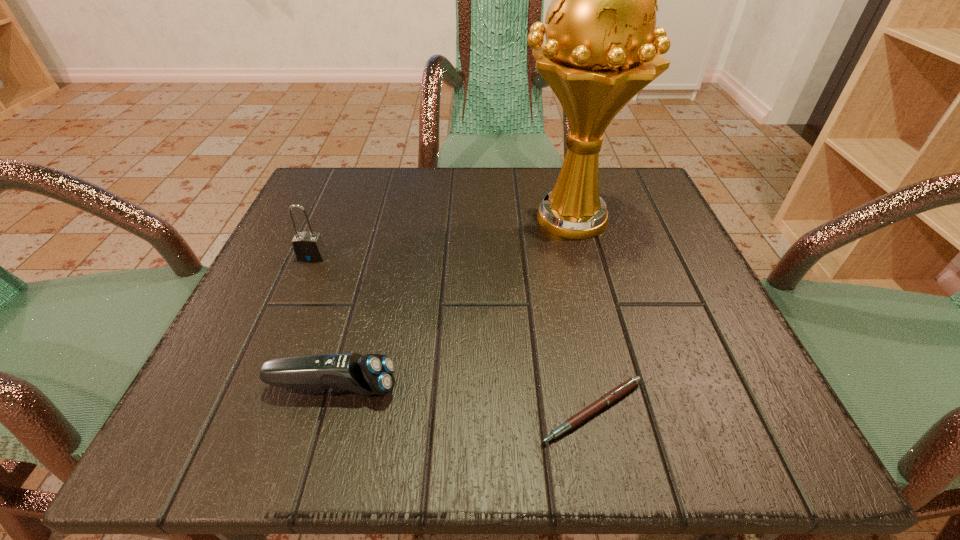
The width and height of the screenshot is (960, 540). Identify the location of trophy_cup. (602, 44).

Locate an element on the screen. The image size is (960, 540). the third shortest object is located at coordinates (308, 246).

This screenshot has height=540, width=960. I want to click on electric shaver, so click(x=372, y=374).

Identify the location of pen. click(x=621, y=390).

Where is `vacant space located 0.250m at the front of the tallest object where the globe is prominent`? Image resolution: width=960 pixels, height=540 pixels. vacant space located 0.250m at the front of the tallest object where the globe is prominent is located at coordinates (390, 218).

Where is `vacant space positioned at the front of the tallest object where the globe is prominent`? This screenshot has width=960, height=540. vacant space positioned at the front of the tallest object where the globe is prominent is located at coordinates click(460, 218).

The width and height of the screenshot is (960, 540). What are the coordinates of `vacant area situated at the front of the tallest object where the globe is prominent` in the screenshot? It's located at (385, 218).

Find the location of a particular element. The width and height of the screenshot is (960, 540). vacant space located on the shackle of the third shortest object is located at coordinates (301, 281).

This screenshot has width=960, height=540. Find the location of `free space located on the head of the second shortest object`. free space located on the head of the second shortest object is located at coordinates (611, 387).

Where is `object located in the far edge section of the desktop`? This screenshot has height=540, width=960. object located in the far edge section of the desktop is located at coordinates (602, 44).